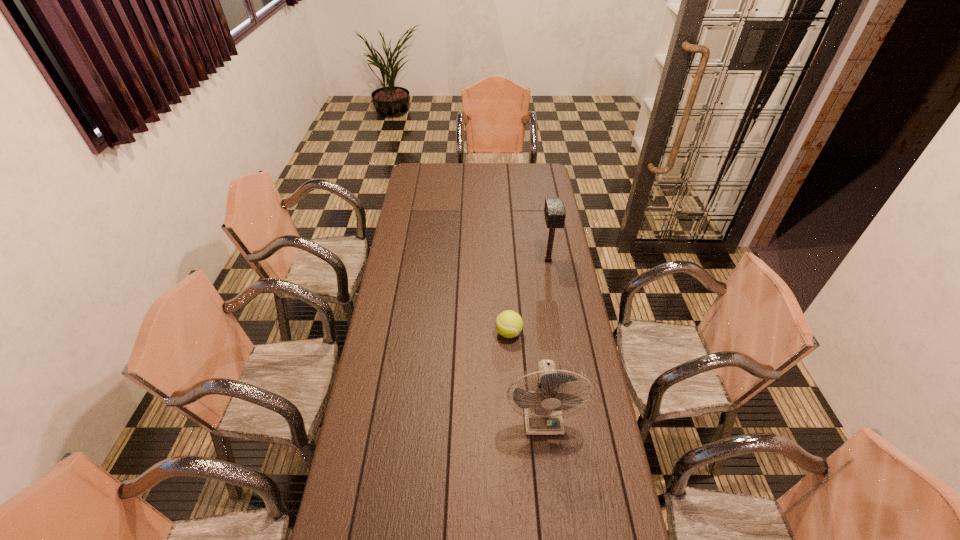
This screenshot has width=960, height=540. Find the location of `fan`. fan is located at coordinates (543, 407).

The width and height of the screenshot is (960, 540). Find the location of `the farthest object`. the farthest object is located at coordinates (554, 211).

This screenshot has height=540, width=960. What are the coordinates of `the shortest object` in the screenshot? It's located at (509, 324).

Identify the location of the second farthest object. (509, 324).

Locate an element on the screen. free space located on the front-facing side of the nearest object is located at coordinates (552, 500).

Where is `free spot located 0.270m on the front of the mallet`? Image resolution: width=960 pixels, height=540 pixels. free spot located 0.270m on the front of the mallet is located at coordinates (557, 310).

Find the location of a particular element. The height and width of the screenshot is (540, 960). vacant area situated on the front of the shortest object is located at coordinates (511, 362).

Locate an element on the screen. The height and width of the screenshot is (540, 960). fan that is at the right edge is located at coordinates (543, 407).

Where is `mallet located at the right edge`? mallet located at the right edge is located at coordinates (554, 211).

Locate an element on the screen. This screenshot has width=960, height=540. vacant area at the far edge of the desktop is located at coordinates [478, 168].